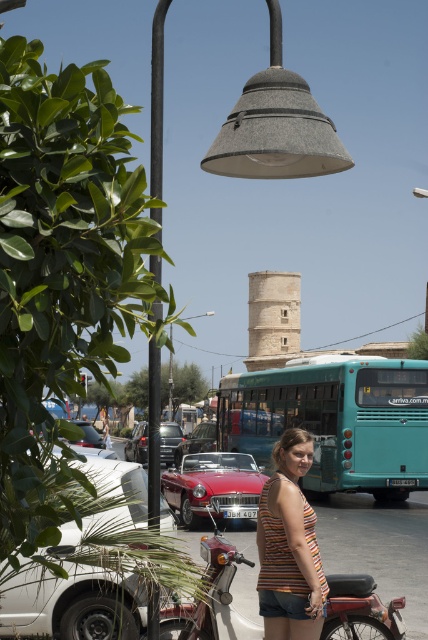
Question: Which object appears farthest from the camera in this image?

Choices:
 (A) metallic red motorcycle at center
 (B) shiny black sedan at center
 (C) shiny red car at center
 (D) teal matte bus at center

Answer: (C)

Question: Estimate the real-world distances between objects in this image. Which object is farther from the white matte car at lower left?

Choices:
 (A) teal matte bus at center
 (B) striped fabric tank top at center
 (C) light beige stone tower at center

Answer: (C)

Question: Is metallic red motorcycle at center thinner than shiny red car at center?

Choices:
 (A) yes
 (B) no

Answer: (A)

Question: Where is white matte car at lower left located in relation to shiny red car at center in the image?

Choices:
 (A) above
 (B) below

Answer: (A)

Question: Which object is farther from the camera taking this photo?

Choices:
 (A) metallic red motorcycle at center
 (B) shiny red convertible at center

Answer: (B)

Question: Is light beige stone tower at center thinner than metallic gray streetlight at upper center?

Choices:
 (A) yes
 (B) no

Answer: (A)